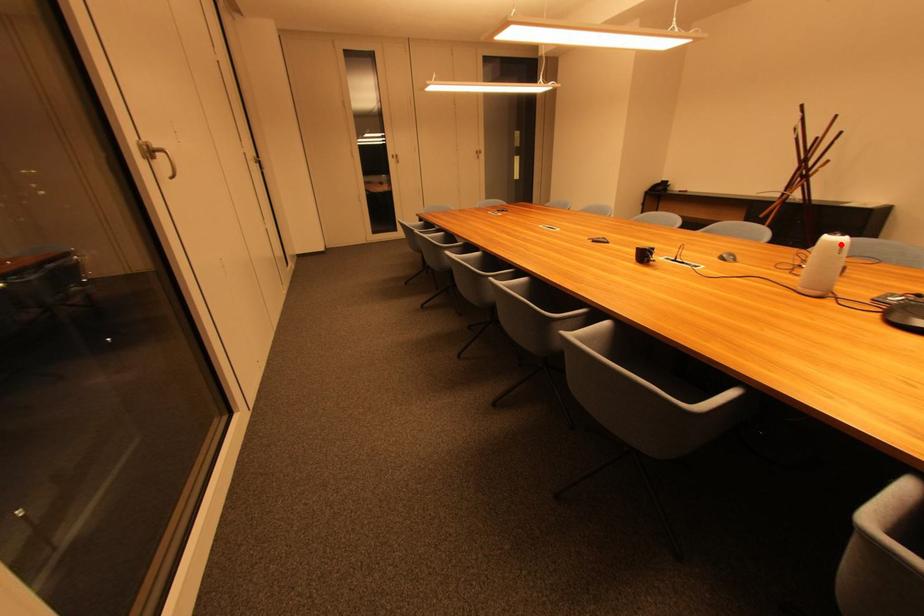
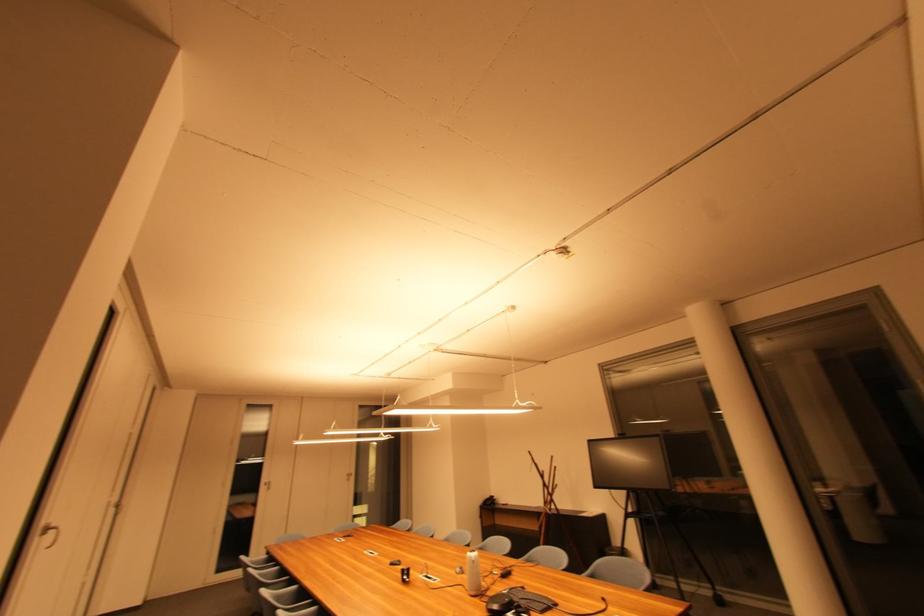
Question: I am providing you with two images of the same scene from different viewpoints. Given a red point in image1, look at the same physical point in image2. Is it:

Choices:
 (A) Closer to the viewpoint
 (B) Farther from the viewpoint

Answer: (B)